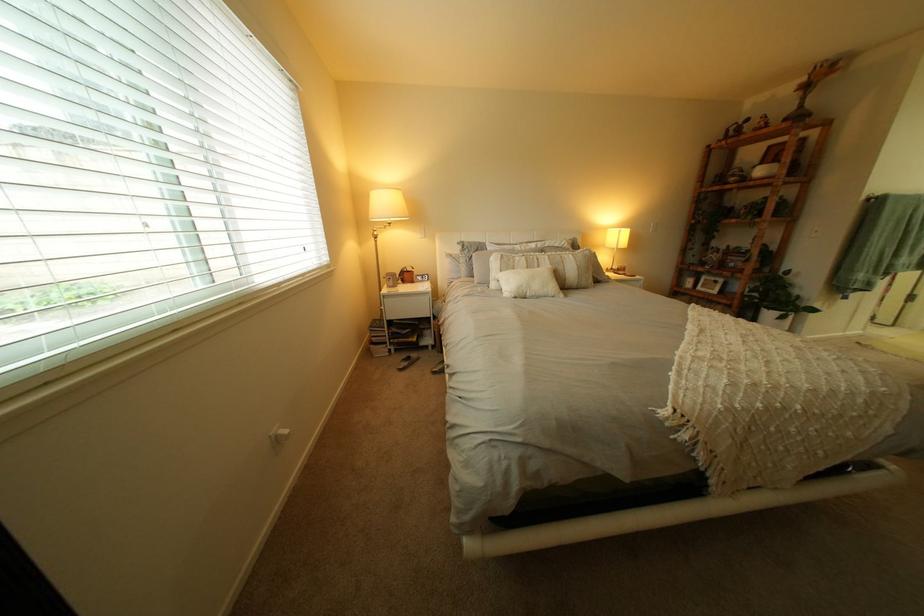
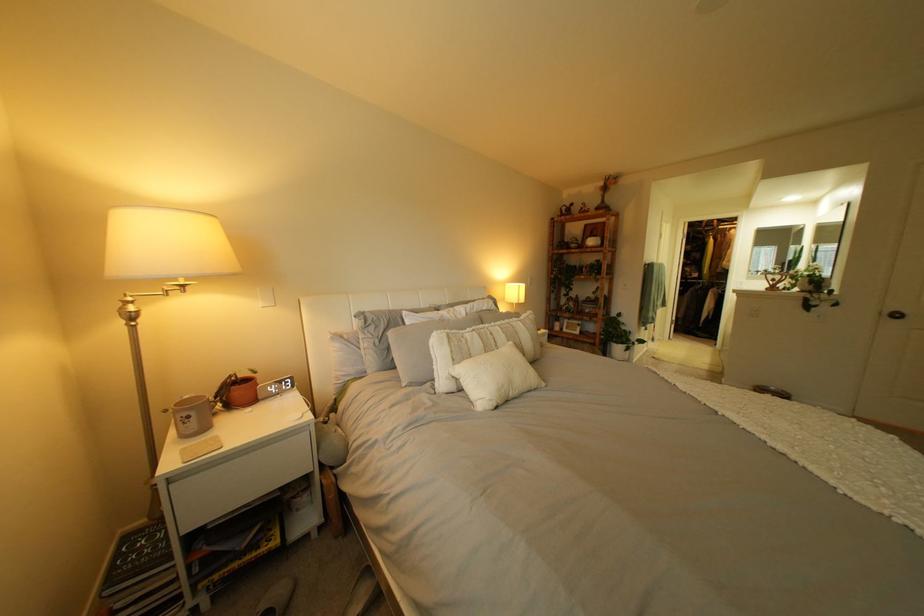
The point at (564, 264) is marked in the first image. Where is the corresponding point in the second image?

(518, 337)